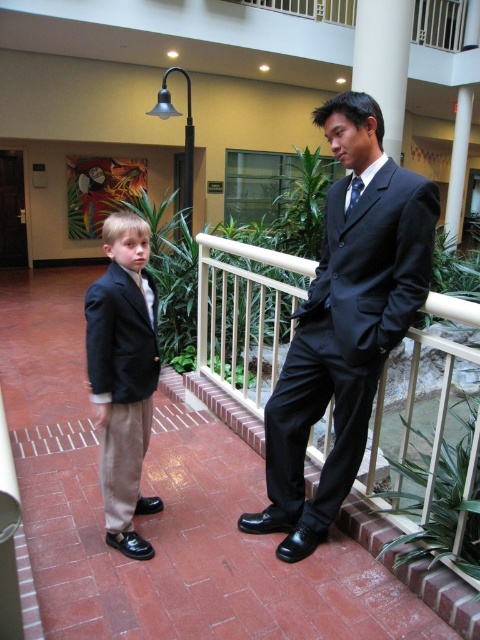
Does matte black suit at left appear over blue silk tie at center?

No.

Identify the location of matte black suit at left. (123, 376).

Is point (290, 460) behind point (110, 248)?

Yes, point (290, 460) is farther from viewer.

Can you confirm if matte black suit at center is positioned below matte black suit at left?

No.

Is point (312, 340) positioned behind point (109, 452)?

No, (312, 340) is closer to viewer.

The image size is (480, 640). What are the coordinates of `matte black suit at center` in the screenshot? It's located at (345, 323).

Consider the image. Is matte black suit at center bigger than blue silk tie at center?

Indeed, matte black suit at center has a larger size compared to blue silk tie at center.

Which of these two, matte black suit at center or blue silk tie at center, stands shorter?

Standing shorter between the two is blue silk tie at center.

Describe the element at coordinates (345, 323) in the screenshot. I see `matte black suit at center` at that location.

Identify the location of matte black suit at center. (345, 323).